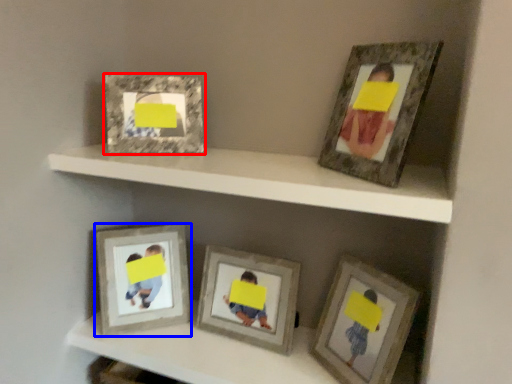
Question: Which object is closer to the camera taking this photo, picture frame (highlighted by a red box) or picture frame (highlighted by a blue box)?

Choices:
 (A) picture frame
 (B) picture frame

Answer: (A)